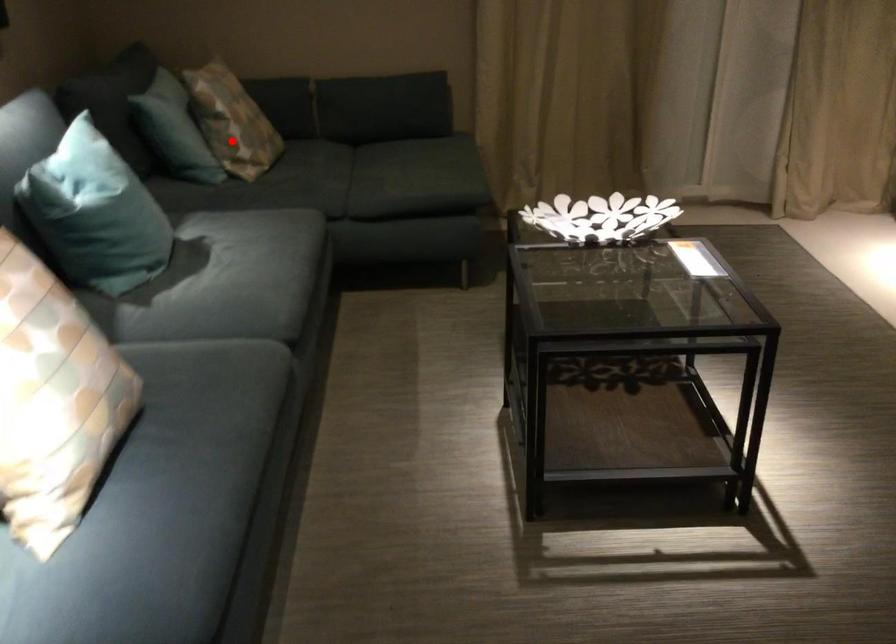
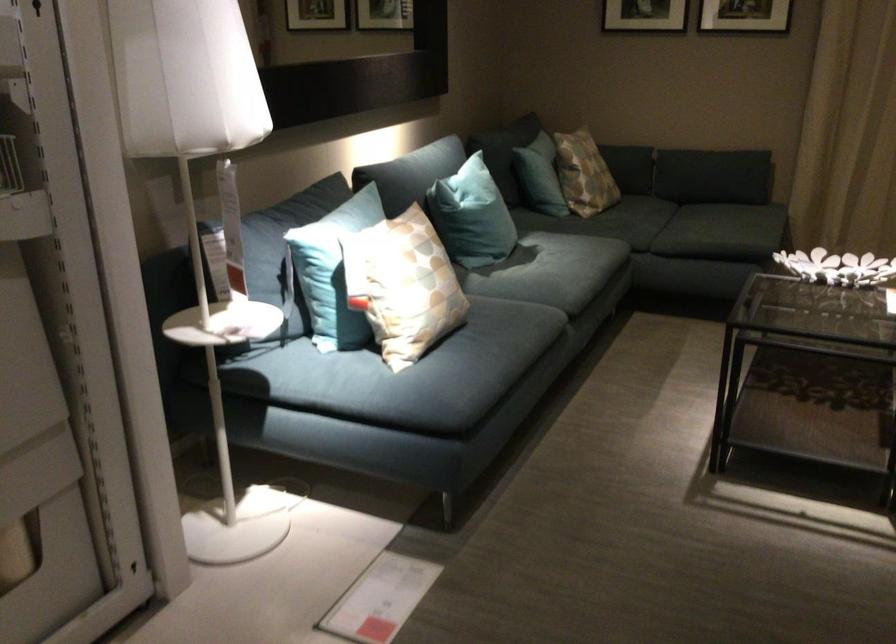
Locate, in the second image, the point that corresponds to the highlighted location in the first image.

(583, 174)